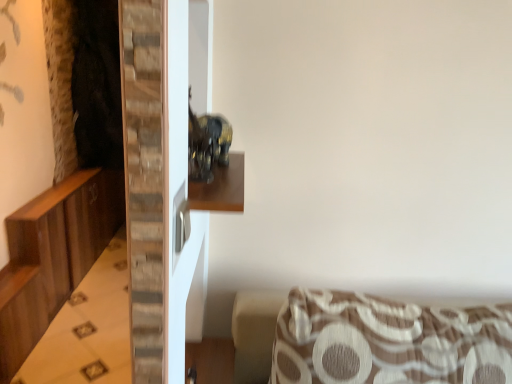
Question: Is wooden shelf at center next to wooden dresser at left and touching it?

Choices:
 (A) yes
 (B) no

Answer: (B)

Question: Can you confirm if wooden shelf at center is smaller than wooden dresser at left?

Choices:
 (A) yes
 (B) no

Answer: (A)

Question: Are wooden shelf at center and wooden dresser at left located far from each other?

Choices:
 (A) no
 (B) yes

Answer: (B)

Question: Is wooden shelf at center surrounding wooden dresser at left?

Choices:
 (A) yes
 (B) no

Answer: (B)

Question: Is wooden shelf at center positioned with its back to wooden dresser at left?

Choices:
 (A) yes
 (B) no

Answer: (B)

Question: From a real-world perspective, is wooden shelf at center physically above wooden dresser at left?

Choices:
 (A) no
 (B) yes

Answer: (B)

Question: Can you confirm if wooden shelf at center is smaller than brown textured cushion at lower right?

Choices:
 (A) yes
 (B) no

Answer: (A)

Question: Is wooden shelf at center taller than brown textured cushion at lower right?

Choices:
 (A) no
 (B) yes

Answer: (A)

Question: Is wooden shelf at center looking in the opposite direction of brown textured cushion at lower right?

Choices:
 (A) yes
 (B) no

Answer: (B)

Question: Can you confirm if wooden shelf at center is thinner than brown textured cushion at lower right?

Choices:
 (A) yes
 (B) no

Answer: (A)

Question: Considering the relative sizes of wooden shelf at center and brown textured cushion at lower right in the image provided, is wooden shelf at center shorter than brown textured cushion at lower right?

Choices:
 (A) no
 (B) yes

Answer: (B)

Question: Is wooden shelf at center at the left side of brown textured cushion at lower right?

Choices:
 (A) yes
 (B) no

Answer: (A)

Question: Is wooden dresser at left facing away from brown textured cushion at lower right?

Choices:
 (A) yes
 (B) no

Answer: (B)